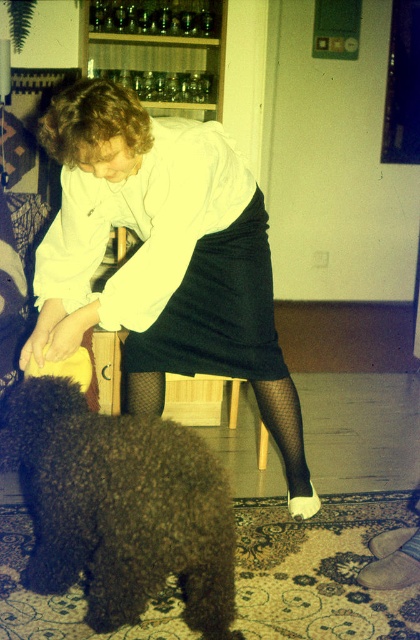
Does point (183, 340) come in front of point (388, 545)?

No.

Does matte white blouse at center appear on the left side of gray fabric stocking at lower right?

Indeed, matte white blouse at center is positioned on the left side of gray fabric stocking at lower right.

The height and width of the screenshot is (640, 420). Find the location of `matte white blouse at center`. matte white blouse at center is located at coordinates (163, 259).

You are a GUI agent. You are given a task and a screenshot of the screen. Output one action in this format:
    pyautogui.click(x=<x>, y=<y>)
    Task: Click on the matte white blouse at center
    The height and width of the screenshot is (640, 420).
    Given the screenshot: What is the action you would take?
    pyautogui.click(x=163, y=259)

Is point (118, 509) closer to viewer compared to point (385, 586)?

Yes, it is in front of point (385, 586).

Which is behind, point (189, 442) or point (393, 561)?

The point (393, 561) is more distant.

The width and height of the screenshot is (420, 640). In order to click on dark brown fur at lower left in this screenshot , I will do point(120,508).

Can you confirm if matte white blouse at center is wider than dark brown fur at lower left?

Yes, matte white blouse at center is wider than dark brown fur at lower left.

Does matte white blouse at center have a lesser height compared to dark brown fur at lower left?

No, matte white blouse at center is not shorter than dark brown fur at lower left.

The width and height of the screenshot is (420, 640). Describe the element at coordinates (163, 259) in the screenshot. I see `matte white blouse at center` at that location.

In order to click on matte white blouse at center in this screenshot , I will do `click(163, 259)`.